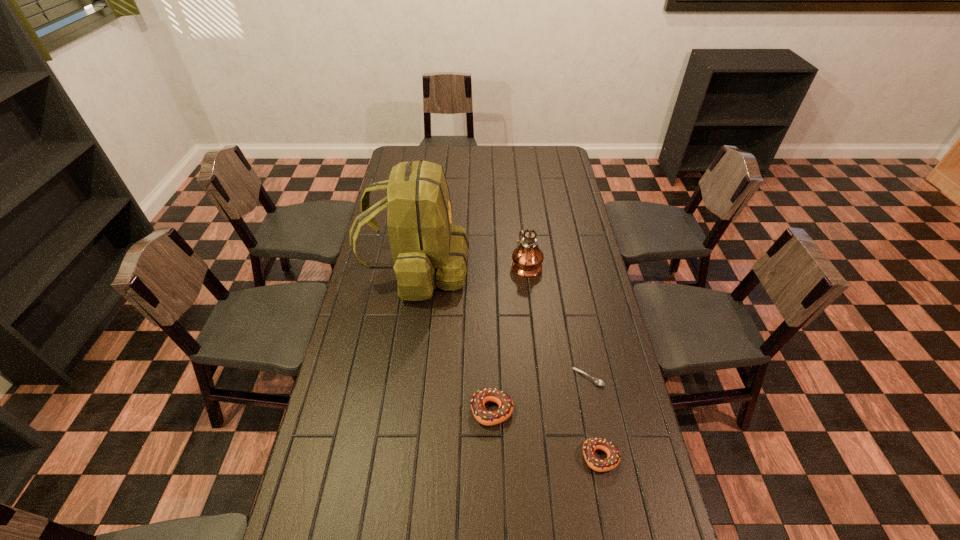
With all doughnuts evenly spaced, where should an extra doughnut be placed on the left to continue the pattern? Please point out a vacant space. Please provide its 2D coordinates. Your answer should be formatted as a tuple, i.e. [(x, y)], where the tuple contains the x and y coordinates of a point satisfying the conditions above.

[(398, 370)]